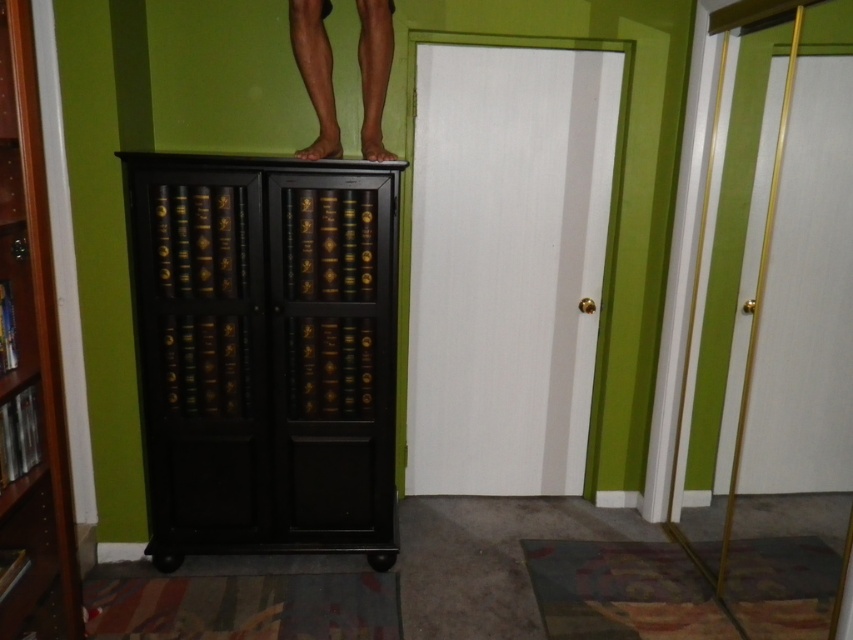
You are a painter who needs to hang a large painting on the wall between the black wood cabinet at upper center and the black wood bookcase at left. Which object is closer to the wall so you can choose the right spot?

The black wood cabinet at upper center is closer to the wall than the black wood bookcase at left, so you should hang the painting near the black wood cabinet at upper center.

You are a drone flying at the center of the room. You need to deliver a small package to the black wood cabinet at upper center. According to the coordinates provided, in which direction should you move to reach it?

The black wood cabinet at upper center is located at coordinates point (265, 353). Since you are at the center of the room, you should move towards the upper direction to reach it.